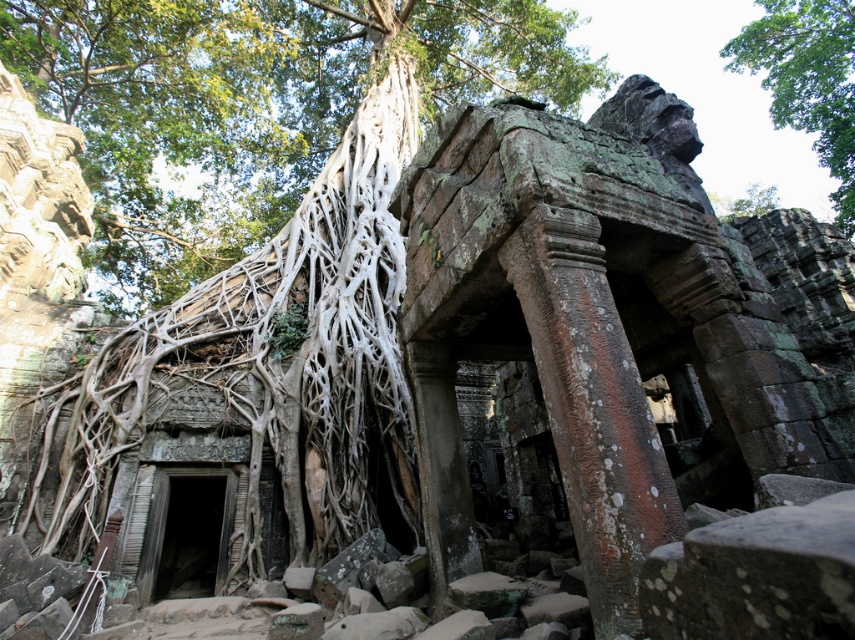
You are an archaeologist examining the ancient stone structure. You notice the white root at left. Can you determine the exact coordinates of this root to document its position relative to the structure?

The white root at left is located at point coordinates (174, 125), so its position can be precisely documented using these coordinates.

You are an archaeologist examining the ancient stone structure. You notice the white root at left and the green leafy tree at upper center. Which of these two objects is shorter in height?

The white root at left is not as tall as the green leafy tree at upper center, so the white root at left is shorter in height.